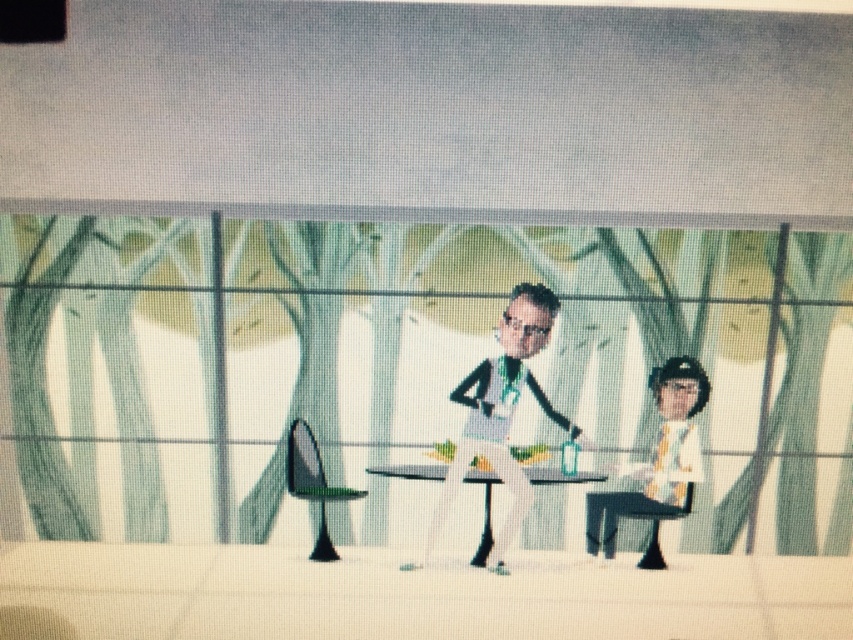
You are designing a new outfit for a character in a video game. The character needs to wear the matte white suit at center and stand next to the white glossy table at center. Since the table is wider, how should you adjust the character positioning to ensure the suit doesn

The matte white suit at center has a lesser width compared to the white glossy table at center. To ensure proper positioning, the character wearing the matte white suit at center should be placed closer to the table or positioned in a way that the narrower suit contrasts well with the wider table.

You are a game developer designing an inventory system for a character in a futuristic setting. The character has a matte white suit at center and a yellow tie at right. Which item should you prioritize for the inventory slot that requires a larger item size?

The matte white suit at center should be prioritized for the inventory slot requiring a larger item size since it is larger in size than the yellow tie at right.

You are a character in the game who needs to place a 10 inch long object between the yellow tie at right and the white glossy table at center. Can you fit it without overlapping either?

The distance between the yellow tie at right and the white glossy table at center is 10.25 inches. Since the object is 10 inches long, it can fit between them without overlapping as there is enough space.